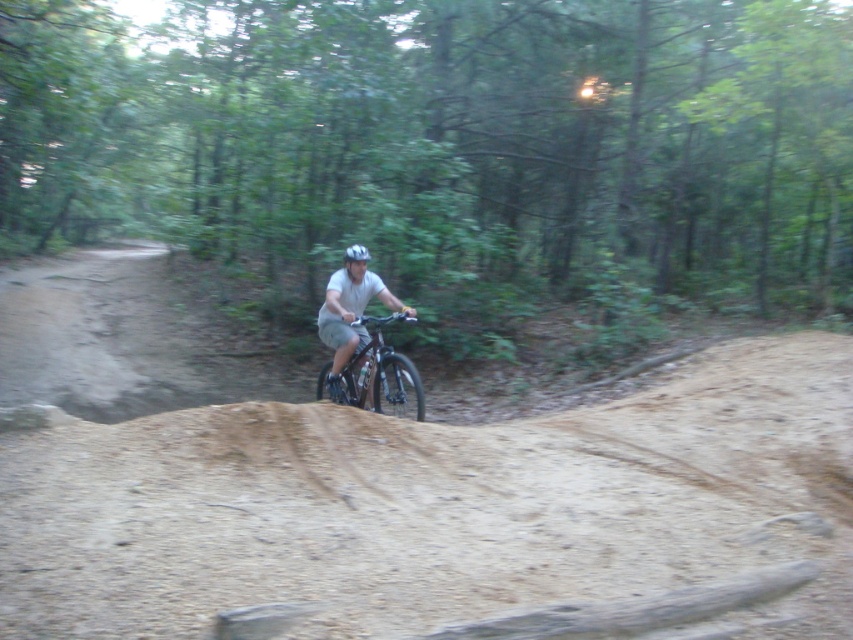
You are a cyclist planning to ride through the forest trail shown in the image. You notice the brown sandy dirt at center and the white matte bicycle helmet at center. Based on their positions, which object is closer to the ground?

The brown sandy dirt at center is located below the white matte bicycle helmet at center, meaning it is closer to the ground.

You are a drone operator trying to capture the rider on the mountain bike. The rider is currently at the point labeled as point (450,515). Based on the scene description, what is the rider standing on at that point?

The rider is standing on brown sandy dirt at center, as point (450,515) corresponds to that location according to the Objects Description.